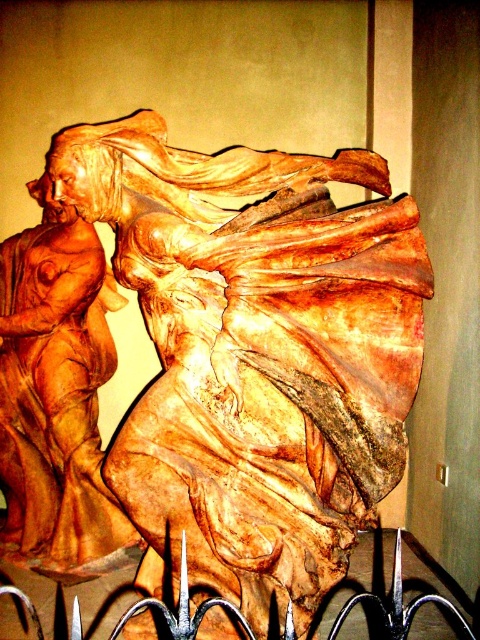
Consider the image. Who is shorter, wooden statue at center or wooden statue at left?

With less height is wooden statue at left.

Who is lower down, wooden statue at center or wooden statue at left?

wooden statue at left

Between point (211, 506) and point (17, 308), which one is positioned in front?

Point (211, 506)

At what (x,y) coordinates should I click in order to perform the action: click on wooden statue at center. Please return your answer as a coordinate pair (x, y). Looking at the image, I should click on (255, 355).